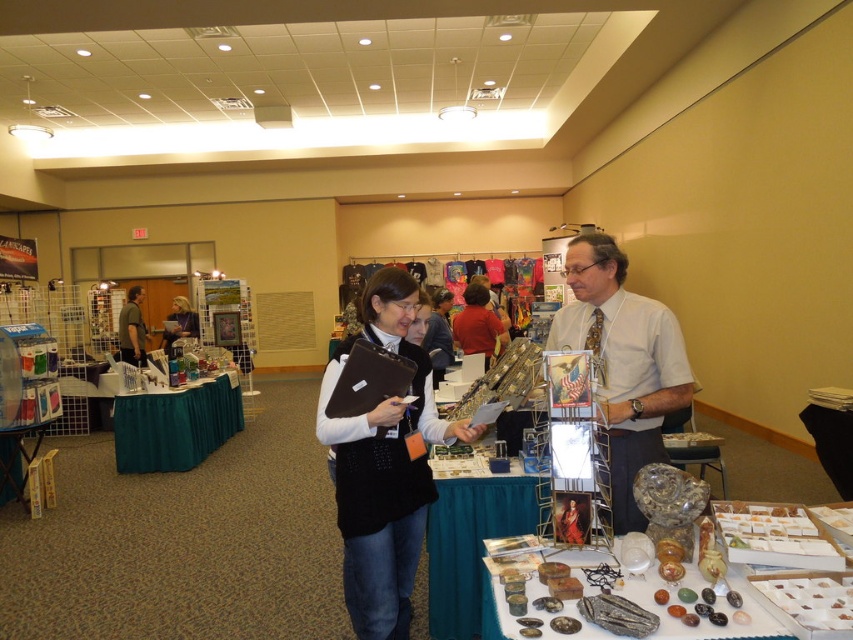
Between matte black sweater at center and matte black folder at center, which one is positioned lower?

Positioned lower is matte black folder at center.

Is point (427, 320) farther from camera compared to point (193, 317)?

No.

I want to click on matte black sweater at center, so click(x=438, y=333).

Who is lower down, black felt vest at center or matte black folder at center?

black felt vest at center

Is black felt vest at center positioned in front of matte black folder at center?

Yes, it is.

Is point (381, 557) less distant than point (167, 317)?

Yes.

Where is `black felt vest at center`? This screenshot has width=853, height=640. black felt vest at center is located at coordinates (384, 467).

Which is behind, point (592, 292) or point (173, 307)?

Point (173, 307)

Is point (613, 492) more distant than point (169, 332)?

No, it is in front of (169, 332).

Who is more distant from viewer, (619, 284) or (184, 321)?

Positioned behind is point (184, 321).

Identify the location of light gray shirt at center. The width and height of the screenshot is (853, 640). (624, 362).